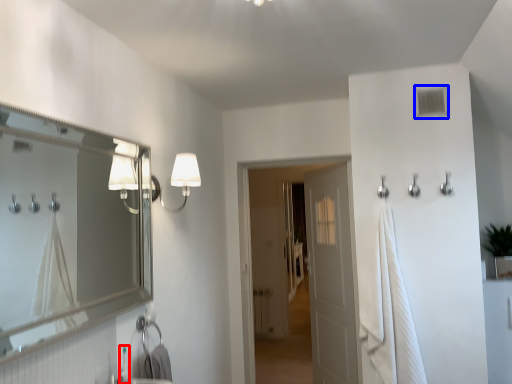
Question: Which of the following is the farthest to the observer, faucet (highlighted by a red box) or window (highlighted by a blue box)?

Choices:
 (A) faucet
 (B) window

Answer: (B)